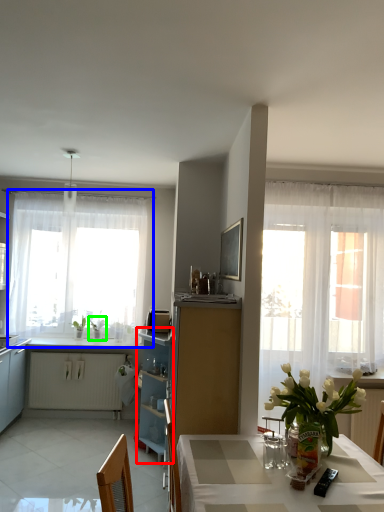
Question: Based on their relative distances, which object is nearer to cabinetry (highlighted by a red box)? Choose from window (highlighted by a blue box) and plant (highlighted by a green box).

Choices:
 (A) window
 (B) plant

Answer: (B)